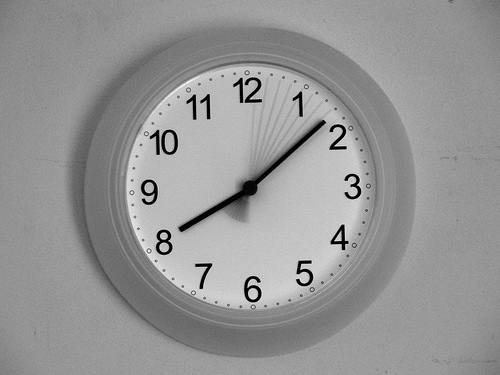
Locate an element on the screen. This screenshot has width=500, height=375. clock frame is located at coordinates (270, 45).